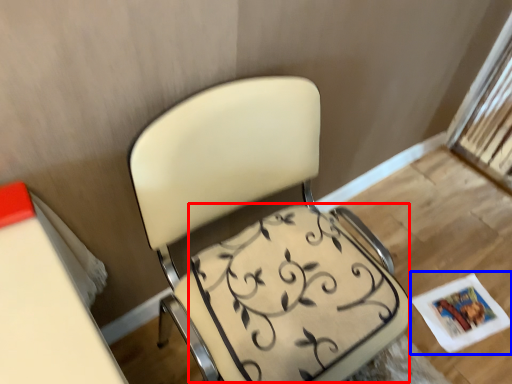
Question: Which point is closer to the camera, swivel chair (highlighted by a red box) or magazine (highlighted by a blue box)?

Choices:
 (A) swivel chair
 (B) magazine

Answer: (A)